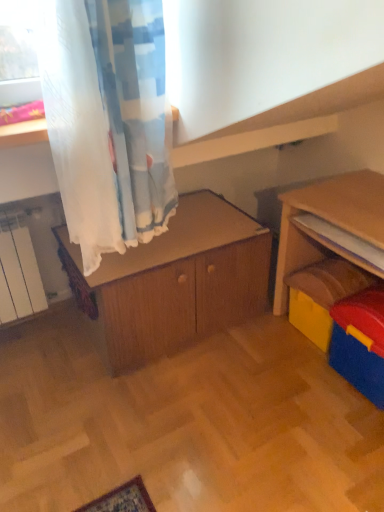
Question: Considering the relative sizes of yellow plastic toy at right and blue plastic storage box at lower right in the image provided, is yellow plastic toy at right shorter than blue plastic storage box at lower right?

Choices:
 (A) yes
 (B) no

Answer: (A)

Question: Is yellow plastic toy at right oriented towards blue plastic storage box at lower right?

Choices:
 (A) no
 (B) yes

Answer: (A)

Question: Does yellow plastic toy at right have a greater height compared to blue plastic storage box at lower right?

Choices:
 (A) no
 (B) yes

Answer: (A)

Question: From a real-world perspective, is yellow plastic toy at right physically above blue plastic storage box at lower right?

Choices:
 (A) yes
 (B) no

Answer: (B)

Question: Considering the relative sizes of yellow plastic toy at right and blue plastic storage box at lower right in the image provided, is yellow plastic toy at right smaller than blue plastic storage box at lower right?

Choices:
 (A) no
 (B) yes

Answer: (B)

Question: From their relative heights in the image, would you say yellow plastic toy at right is taller or shorter than wooden cabinet at center?

Choices:
 (A) tall
 (B) short

Answer: (B)

Question: Does point (304, 327) appear closer or farther from the camera than point (119, 293)?

Choices:
 (A) farther
 (B) closer

Answer: (A)

Question: Choose the correct answer: Is yellow plastic toy at right inside wooden cabinet at center or outside it?

Choices:
 (A) outside
 (B) inside

Answer: (A)

Question: From a real-world perspective, is yellow plastic toy at right above or below wooden cabinet at center?

Choices:
 (A) above
 (B) below

Answer: (B)

Question: Looking at their shapes, would you say wooden bookshelf at right is wider or thinner than blue plastic storage box at lower right?

Choices:
 (A) thin
 (B) wide

Answer: (A)

Question: From the image's perspective, relative to blue plastic storage box at lower right, is wooden bookshelf at right above or below?

Choices:
 (A) above
 (B) below

Answer: (A)

Question: Would you say wooden bookshelf at right is to the left or to the right of blue plastic storage box at lower right in the picture?

Choices:
 (A) left
 (B) right

Answer: (A)

Question: Is wooden bookshelf at right spatially inside blue plastic storage box at lower right, or outside of it?

Choices:
 (A) outside
 (B) inside

Answer: (A)

Question: Relative to yellow plastic toy at right, is blue plastic storage box at lower right in front or behind?

Choices:
 (A) front
 (B) behind

Answer: (A)

Question: Is blue plastic storage box at lower right taller or shorter than yellow plastic toy at right?

Choices:
 (A) tall
 (B) short

Answer: (A)